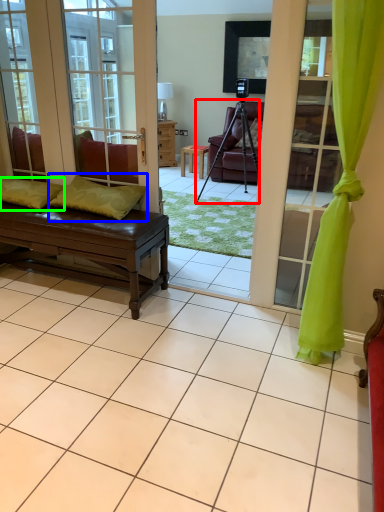
Question: Which is nearer to the tripod (highlighted by a red box)? pillow (highlighted by a blue box) or pillow (highlighted by a green box).

Choices:
 (A) pillow
 (B) pillow

Answer: (A)